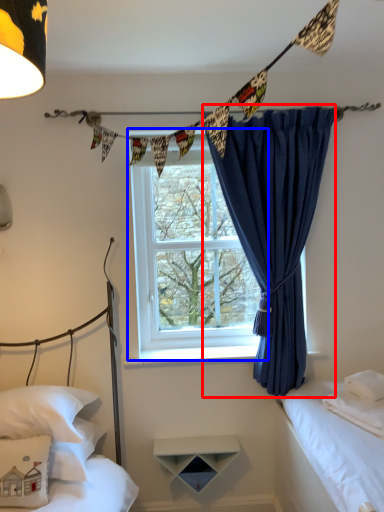
Question: Among these objects, which one is farthest to the camera, curtain (highlighted by a red box) or window (highlighted by a blue box)?

Choices:
 (A) curtain
 (B) window

Answer: (B)